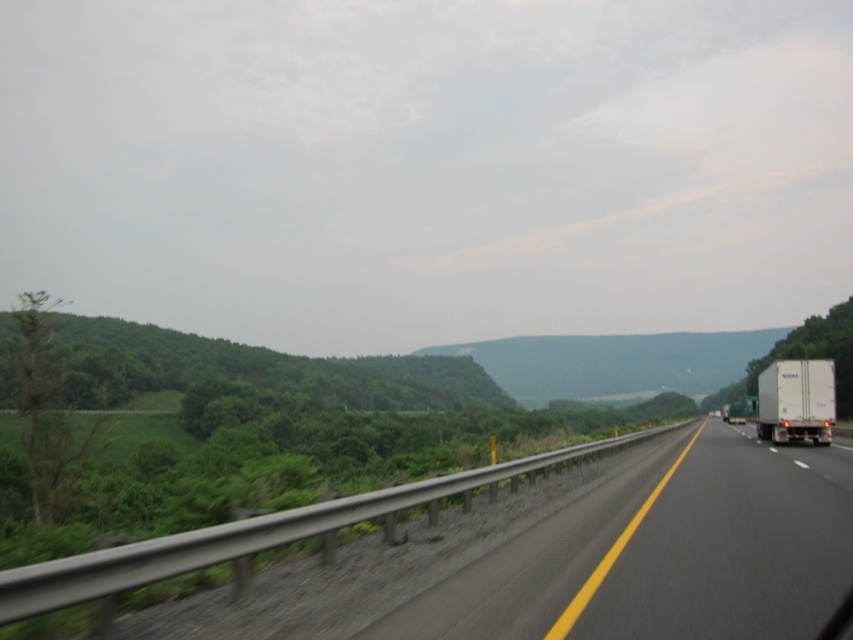
Question: Is the position of black asphalt highway at center less distant than that of white matte trailer truck at right?

Choices:
 (A) yes
 (B) no

Answer: (A)

Question: Can you confirm if black asphalt highway at center is positioned to the left of white matte trailer truck at right?

Choices:
 (A) yes
 (B) no

Answer: (A)

Question: Which object appears farthest from the camera in this image?

Choices:
 (A) black asphalt highway at center
 (B) white matte trailer truck at right

Answer: (B)

Question: Which point is farther from the camera taking this photo?

Choices:
 (A) (456, 596)
 (B) (828, 406)

Answer: (B)

Question: Is black asphalt highway at center bigger than white matte trailer truck at right?

Choices:
 (A) yes
 (B) no

Answer: (B)

Question: Which point is farther to the camera?

Choices:
 (A) white matte trailer truck at right
 (B) black asphalt highway at center

Answer: (A)